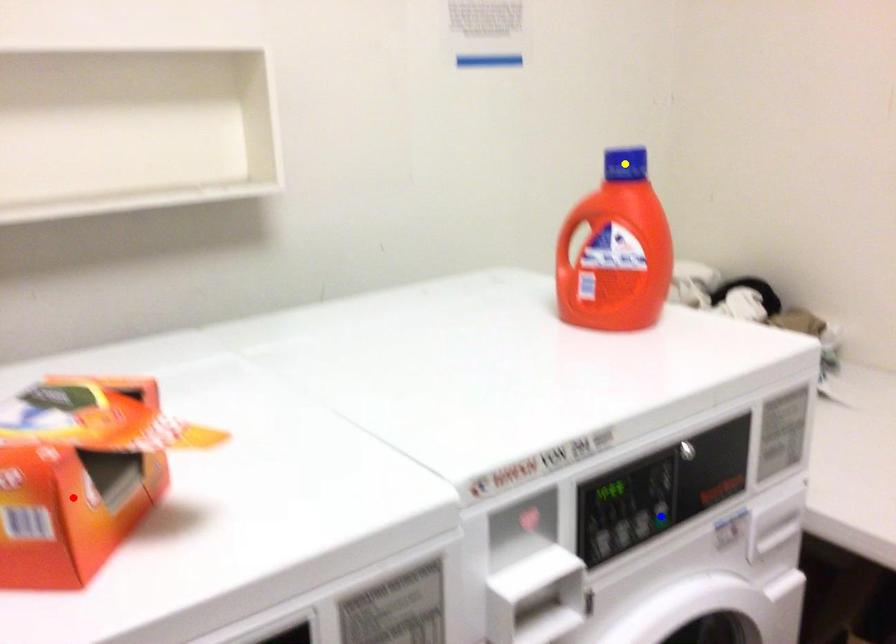
Order these from nearest to farthest:
red point, blue point, yellow point

yellow point < blue point < red point